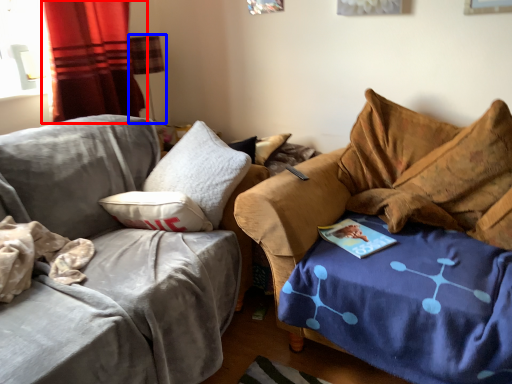
Question: Which of the following is the farthest to the observer, curtain (highlighted by a red box) or lamp (highlighted by a blue box)?

Choices:
 (A) curtain
 (B) lamp

Answer: (B)